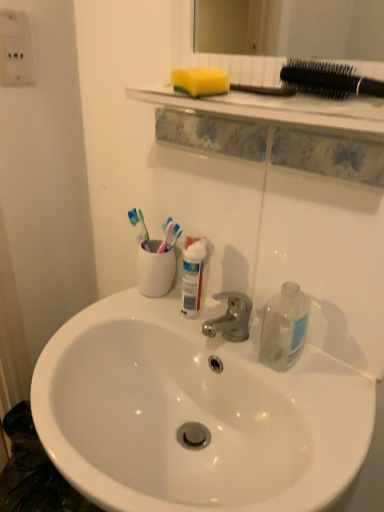
Identify the location of free space to the left of black plastic hairbrush at upper right. This screenshot has height=512, width=384. (272, 99).